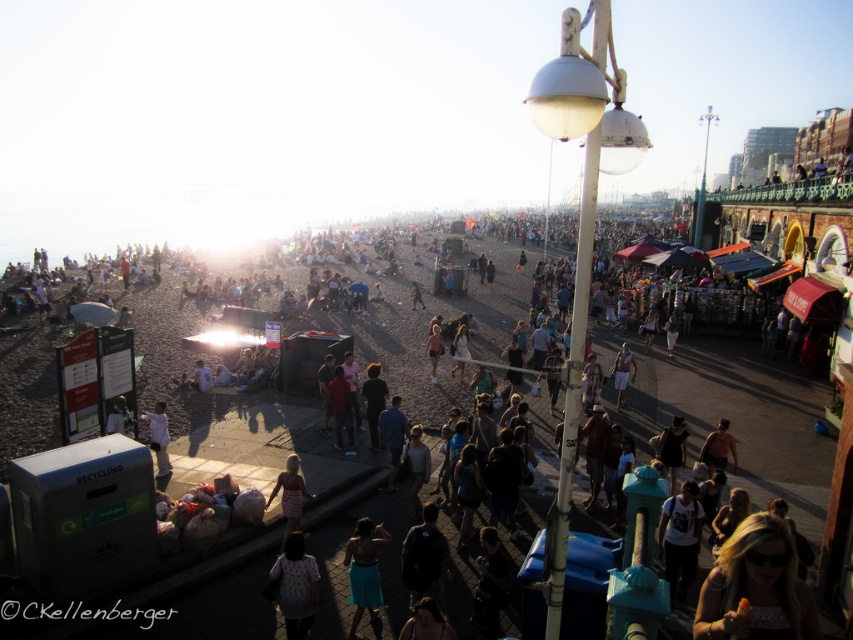
You are standing on the boardwalk and want to move from point A to point B. Point A is located at coordinates point (332, 406) and point B is at point (158, 464). Since you can only move forward, will you be able to see point B from point A?

→ Point (332, 406) is further to the viewer than point (158, 464), so yes, you can see point B from point A because it is closer to you.

From the picture: You are standing on the boardwalk and see a white dotted sweater at lower center and a tan skin person at center. Which object is nearer to you?

The white dotted sweater at lower center is closer to the viewer than the tan skin person at center.

You are a photographer trying to capture a candid shot of the tan skin person at center without including the white dotted sweater at lower center in the frame. Given their sizes, is this possible?

The white dotted sweater at lower center is larger in size than the tan skin person at center, so it might block the view. To avoid including the sweater, the photographer should adjust their angle or position to ensure the sweater is out of the frame while still capturing the person.